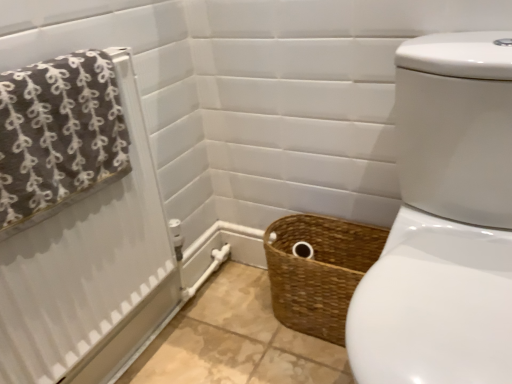
I want to click on brown fabric towel at upper left, so click(90, 270).

What do you see at coordinates (58, 136) in the screenshot? This screenshot has height=384, width=512. I see `brown textured towel at left` at bounding box center [58, 136].

This screenshot has height=384, width=512. What are the coordinates of `brown fabric towel at upper left` in the screenshot? It's located at (90, 270).

Who is bigger, brown fabric towel at upper left or brown woven basket at lower center?

Bigger between the two is brown woven basket at lower center.

From the image's perspective, would you say brown fabric towel at upper left is positioned over brown woven basket at lower center?

Indeed, from the image's perspective, brown fabric towel at upper left is shown above brown woven basket at lower center.

Is brown fabric towel at upper left not within brown woven basket at lower center?

brown fabric towel at upper left lies outside brown woven basket at lower center's area.

Is point (42, 241) positioned behind point (348, 286)?

No, (42, 241) is closer to viewer.

Between brown fabric towel at upper left and brown textured towel at left, which one has smaller size?

brown fabric towel at upper left.

Is brown fabric towel at upper left facing towards brown textured towel at left?

Yes, brown fabric towel at upper left is turned towards brown textured towel at left.

Is brown fabric towel at upper left touching brown textured towel at left?

No, brown fabric towel at upper left is not touching brown textured towel at left.

Considering the positions of points (91, 226) and (64, 101), is point (91, 226) farther from camera compared to point (64, 101)?

Yes, point (91, 226) is farther from viewer.

Could you tell me if brown woven basket at lower center is facing brown fabric towel at upper left?

No.

From the picture: From their relative heights in the image, would you say brown woven basket at lower center is taller or shorter than brown fabric towel at upper left?

In the image, brown woven basket at lower center appears to be shorter than brown fabric towel at upper left.

Consider the image. From the image's perspective, does brown woven basket at lower center appear higher than brown fabric towel at upper left?

No, from the image's perspective, brown woven basket at lower center is not on top of brown fabric towel at upper left.

Looking at this image, is there a large distance between brown woven basket at lower center and brown fabric towel at upper left?

brown woven basket at lower center is actually quite close to brown fabric towel at upper left.

Considering the relative sizes of brown textured towel at left and brown fabric towel at upper left in the image provided, is brown textured towel at left shorter than brown fabric towel at upper left?

Yes.

You are a GUI agent. You are given a task and a screenshot of the screen. Output one action in this format:
    pyautogui.click(x=<x>, y=<y>)
    Task: Click on the bath towel above the brown fabric towel at upper left (from the image's perspective)
    The image size is (512, 384).
    Given the screenshot: What is the action you would take?
    pyautogui.click(x=58, y=136)

Can you tell me how much brown textured towel at left and brown fabric towel at upper left differ in facing direction?

0.00556 degrees separate the facing orientations of brown textured towel at left and brown fabric towel at upper left.

Can you confirm if brown textured towel at left is positioned to the left of brown fabric towel at upper left?

Yes.

Who is taller, brown woven basket at lower center or brown textured towel at left?

Standing taller between the two is brown woven basket at lower center.

Is brown woven basket at lower center wider or thinner than brown textured towel at left?

In the image, brown woven basket at lower center appears to be wider than brown textured towel at left.

From a real-world perspective, is brown woven basket at lower center on top of brown textured towel at left?

No, from a real-world perspective, brown woven basket at lower center is not on top of brown textured towel at left.

Is brown woven basket at lower center surrounding brown textured towel at left?

No, brown textured towel at left is not a part of brown woven basket at lower center.

From the picture: From a real-world perspective, who is located higher, brown textured towel at left or brown woven basket at lower center?

brown textured towel at left, from a real-world perspective.

From the image's perspective, who appears lower, brown textured towel at left or brown woven basket at lower center?

From the image's view, brown woven basket at lower center is below.

This screenshot has width=512, height=384. What are the coordinates of `shower curtain in front of the brown woven basket at lower center` in the screenshot? It's located at (90, 270).

The width and height of the screenshot is (512, 384). Find the location of `bath towel on the left of brown fabric towel at upper left`. bath towel on the left of brown fabric towel at upper left is located at coordinates (58, 136).

Estimate the real-world distances between objects in this image. Which object is closer to brown textured towel at left, brown woven basket at lower center or brown fabric towel at upper left?

The object closer to brown textured towel at left is brown fabric towel at upper left.

From the image, which object appears to be farther from brown textured towel at left, brown fabric towel at upper left or brown woven basket at lower center?

brown woven basket at lower center.

From the picture: Which object lies nearer to the anchor point brown woven basket at lower center, brown textured towel at left or brown fabric towel at upper left?

The object closer to brown woven basket at lower center is brown fabric towel at upper left.

Estimate the real-world distances between objects in this image. Which object is further from brown woven basket at lower center, brown fabric towel at upper left or brown textured towel at left?

The object further to brown woven basket at lower center is brown textured towel at left.

Considering their positions, is brown textured towel at left positioned further to brown fabric towel at upper left than brown woven basket at lower center?

Based on the image, brown woven basket at lower center appears to be further to brown fabric towel at upper left.

From the image, which object appears to be nearer to brown fabric towel at upper left, brown woven basket at lower center or brown textured towel at left?

Among the two, brown textured towel at left is located nearer to brown fabric towel at upper left.

Locate an element on the screen. shower curtain located between brown textured towel at left and brown woven basket at lower center in the left-right direction is located at coordinates (90, 270).